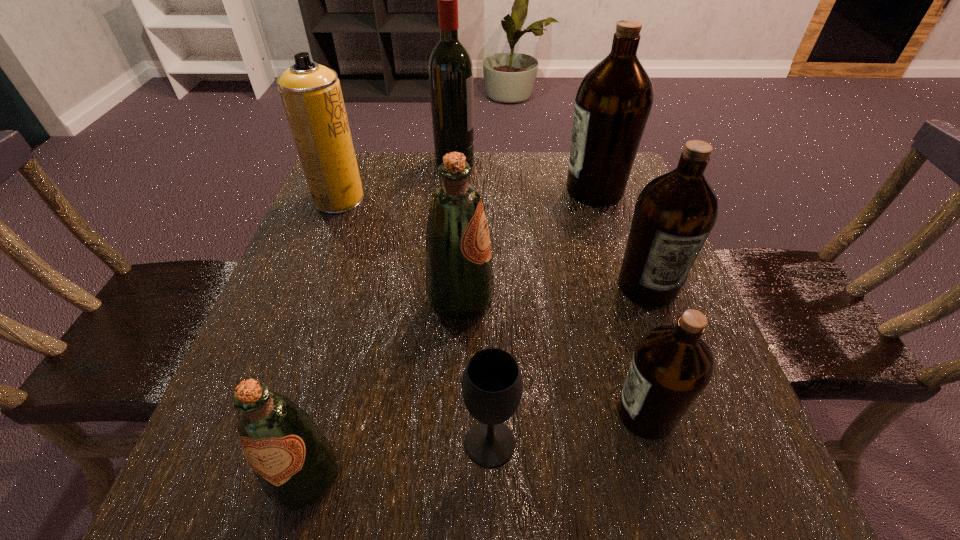
I want to click on object located at the near left corner, so (x=294, y=462).

The height and width of the screenshot is (540, 960). In order to click on object located in the far right corner section of the desktop in this screenshot , I will do `click(613, 102)`.

The height and width of the screenshot is (540, 960). What are the coordinates of `vacant region at the far edge of the desktop` in the screenshot? It's located at (425, 188).

Where is `vacant space at the near edge of the desktop`? vacant space at the near edge of the desktop is located at coordinates (439, 478).

In the image, there is a desktop. Identify the location of vacant space at the left edge. The width and height of the screenshot is (960, 540). (318, 233).

Identify the location of blank space at the right edge of the desktop. (613, 341).

This screenshot has height=540, width=960. In order to click on vacant point located between the nearest brown olive oil and the biggest brown olive oil in this screenshot , I will do `click(620, 302)`.

This screenshot has width=960, height=540. I want to click on free space between the wineglass and the second biggest brown olive oil, so click(568, 364).

This screenshot has width=960, height=540. What are the coordinates of `blank region between the smallest brown olive oil and the wineglass` in the screenshot? It's located at (568, 428).

Identify the location of empty location between the shortest object and the aerosol can. This screenshot has width=960, height=540. (415, 321).